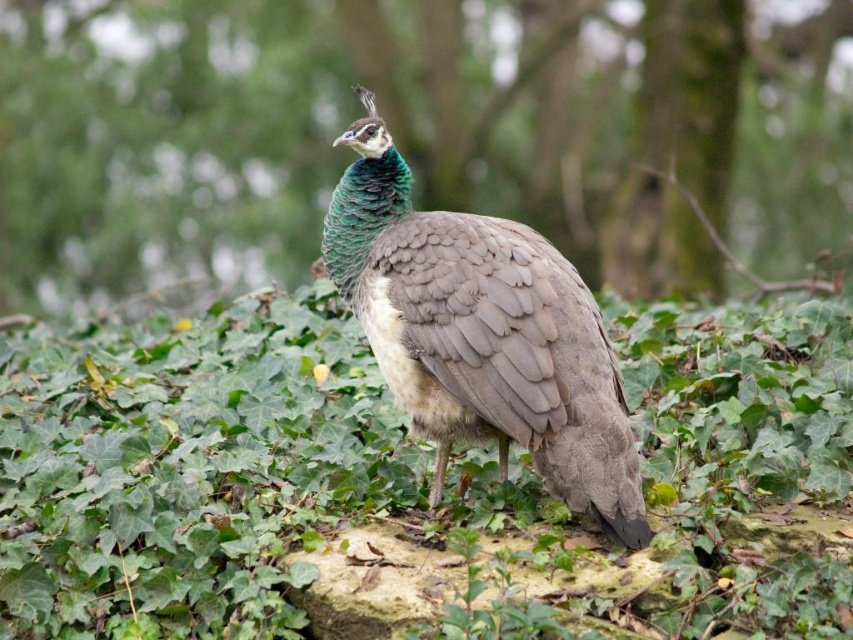
You are a photographer trying to capture the shiny green peacock at center in the image. You notice the green leafy grass at center is blocking the view. Can you determine if the grass is large enough to completely cover the peacock?

The green leafy grass at center is larger in size than shiny green peacock at center, so yes, the grass can completely cover the peacock.

You are standing in the forest where the peacock is. There are two points marked in the image, one at coordinates point (392, 86) and the other at point (840, 476). Which point is closer to you?

Point (840, 476) is closer to you because point (392, 86) is behind it.